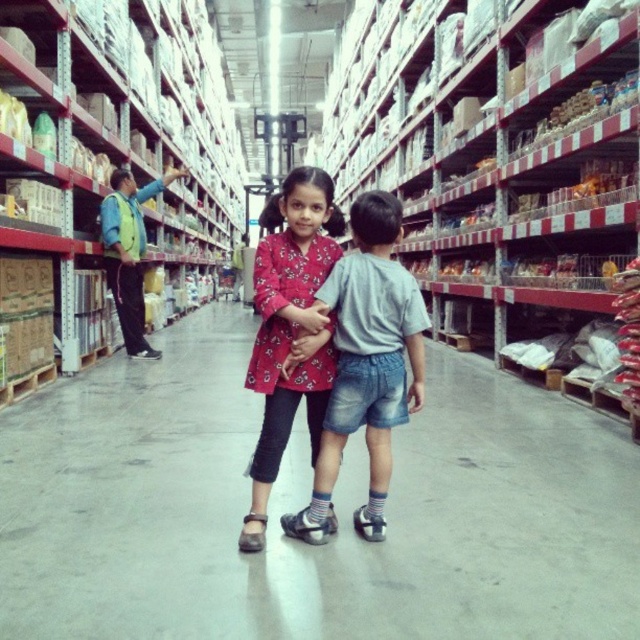
You are a delivery person carrying a box that is 2 meters long. You need to move from the metallic silver shelves at center to the matte floral shirt at center. Can you pass through the space between them without tilting the box?

The distance between the metallic silver shelves at center and the matte floral shirt at center is 2.27 meters. Since the box is 2 meters long, it can fit within the available space, so you can pass through without tilting the box.

You are a forklift operator who needs to transport the matte floral shirt at center to the matte cardboard boxes at left. Given that your forklift has a maximum load capacity of 1000 kg, and the combined weight of the shirt and the boxes is 950 kg, can you safely make this transfer?

The distance between the matte cardboard boxes at left and the matte floral shirt at center is 7.45 meters. Since the combined weight of 950 kg is under the forklifts 1000 kg limit, you can safely transport the matte floral shirt at center to the matte cardboard boxes at left.